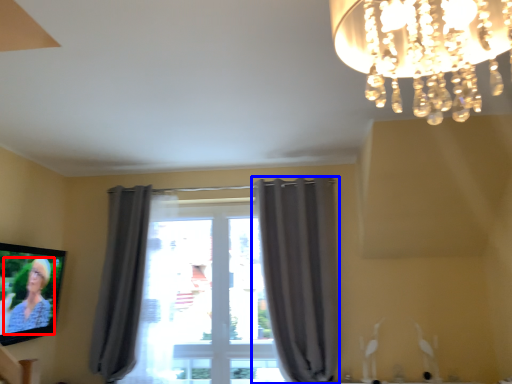
Question: Which object appears farthest to the camera in this image, person (highlighted by a red box) or curtain (highlighted by a blue box)?

Choices:
 (A) person
 (B) curtain

Answer: (B)